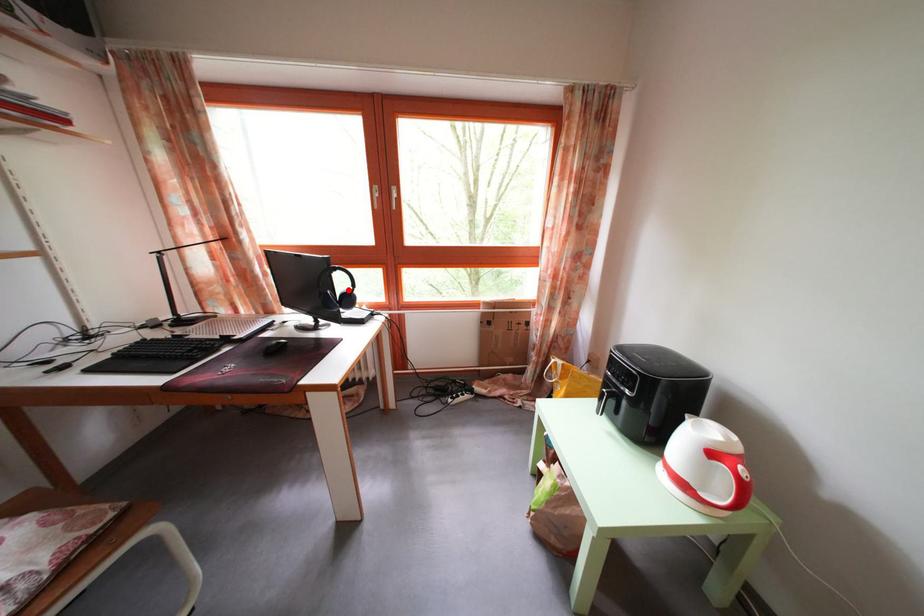
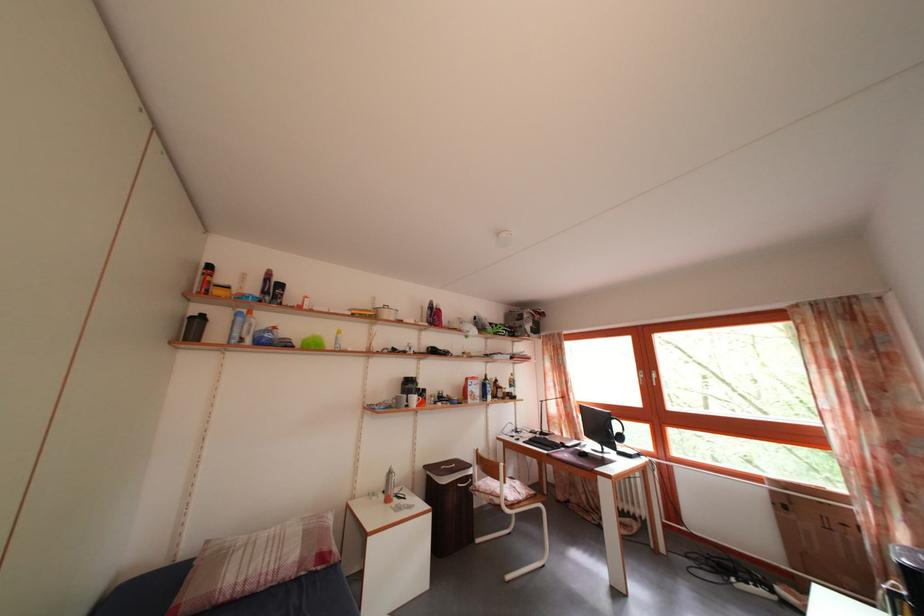
Question: A red point is marked in image1. In image2, is the corresponding 3D point closer to the camera or farther? Reply with the corresponding letter.

Choices:
 (A) The corresponding 3D point is closer.
 (B) The corresponding 3D point is farther.

Answer: (B)